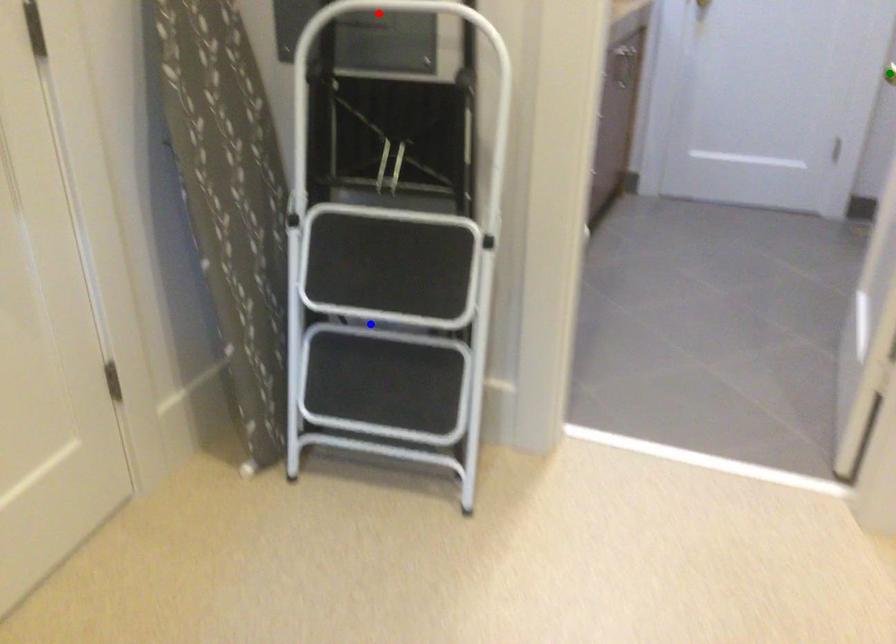
Order these from nearest to farthest:
A) red point
B) blue point
C) green point

red point, blue point, green point